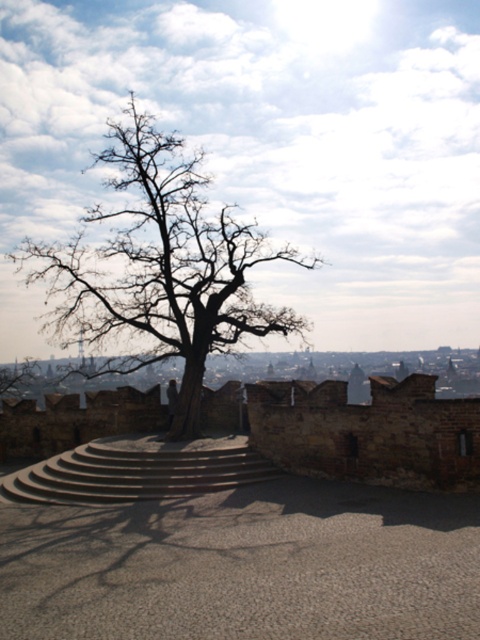
Question: Which point is farther to the camera?

Choices:
 (A) concrete stairs at center
 (B) bare wood tree at center

Answer: (B)

Question: Is the position of bare wood tree at center more distant than that of concrete stairs at center?

Choices:
 (A) yes
 (B) no

Answer: (A)

Question: Does bare wood tree at center have a lesser width compared to concrete stairs at center?

Choices:
 (A) yes
 (B) no

Answer: (B)

Question: Among these objects, which one is nearest to the camera?

Choices:
 (A) bare wood tree at center
 (B) concrete stairs at center

Answer: (B)

Question: Observing the image, what is the correct spatial positioning of bare wood tree at center in reference to concrete stairs at center?

Choices:
 (A) right
 (B) left

Answer: (B)